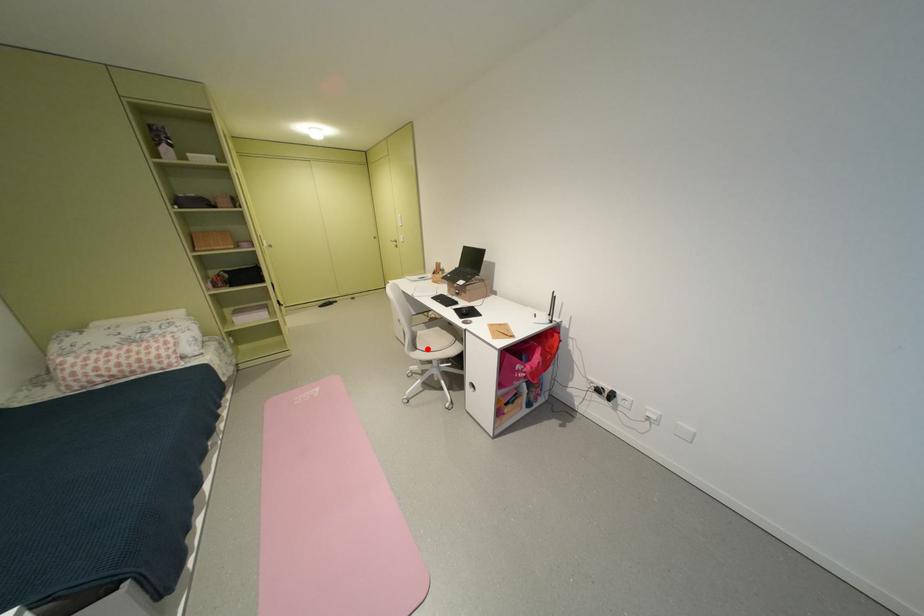
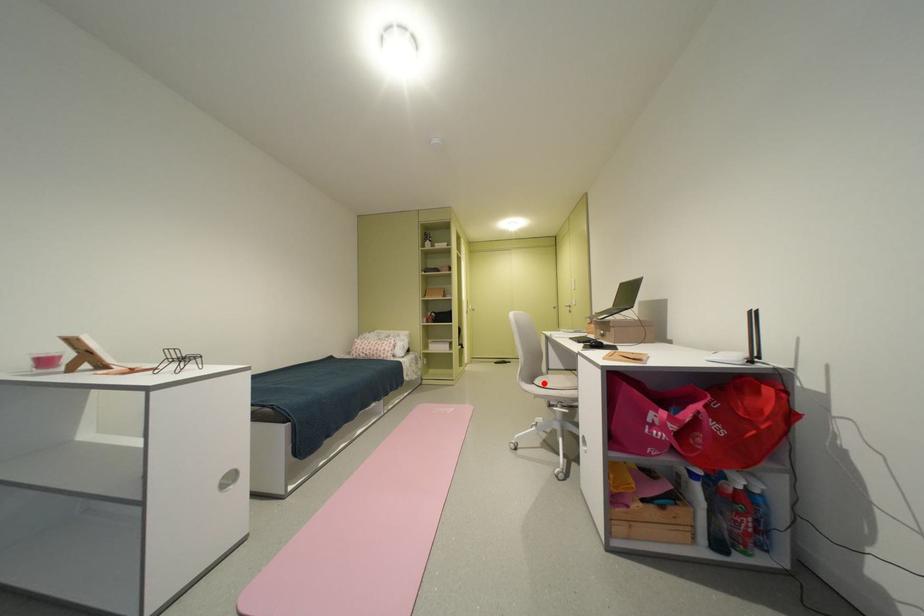
I am providing you with two images of the same scene from different viewpoints. A red point is marked on the first image and another point is marked on the second image. Does the point marked in image1 correspond to the same location as the one in image2?

Yes